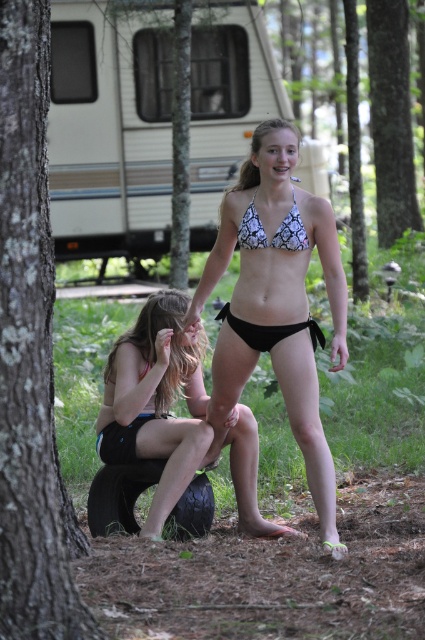
Question: In this image, where is brown rough bark tree at left located relative to white printed bikini at center?

Choices:
 (A) above
 (B) below

Answer: (A)

Question: Which of the following is the farthest from the observer?

Choices:
 (A) beige plastic camper at upper center
 (B) white printed bikini at center
 (C) snake print bikini top at center
 (D) black rubber tire at lower center

Answer: (A)

Question: Is the position of black rubber tire at lower center less distant than that of black bikini at center?

Choices:
 (A) no
 (B) yes

Answer: (A)

Question: Does brown rough bark tree at left have a smaller size compared to black bikini at center?

Choices:
 (A) yes
 (B) no

Answer: (B)

Question: Which is farther from the snake print bikini top at center?

Choices:
 (A) smooth bark tree at center
 (B) white printed bikini at center
 (C) white snake-patterned bikini at center
 (D) brown rough bark tree at left

Answer: (A)

Question: Among these points, which one is nearest to the camera?

Choices:
 (A) (261, 236)
 (B) (286, 195)
 (C) (373, 60)
 (D) (297, 125)

Answer: (A)